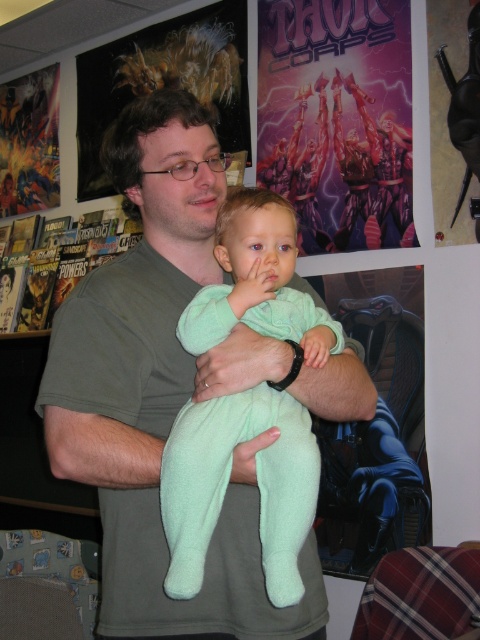
Question: Is green fleece shirt at center thinner than purple matte poster at upper center?

Choices:
 (A) yes
 (B) no

Answer: (B)

Question: Which of these objects is positioned farthest from the purple matte poster at upper center?

Choices:
 (A) mint fleece onesie at center
 (B) metallic silver figure at upper left
 (C) green fleece shirt at center

Answer: (B)

Question: Can you confirm if mint fleece onesie at center is wider than metallic silver figure at upper left?

Choices:
 (A) yes
 (B) no

Answer: (B)

Question: Which object is the closest to the metallic silver figure at upper left?

Choices:
 (A) purple matte poster at upper center
 (B) green fleece shirt at center
 (C) mint fleece onesie at center

Answer: (A)

Question: Is mint fleece onesie at center to the right of metallic silver figure at upper left from the viewer's perspective?

Choices:
 (A) yes
 (B) no

Answer: (A)

Question: Which of these objects is positioned farthest from the green fleece shirt at center?

Choices:
 (A) purple matte poster at upper center
 (B) mint fleece onesie at center
 (C) metallic silver figure at upper left

Answer: (C)